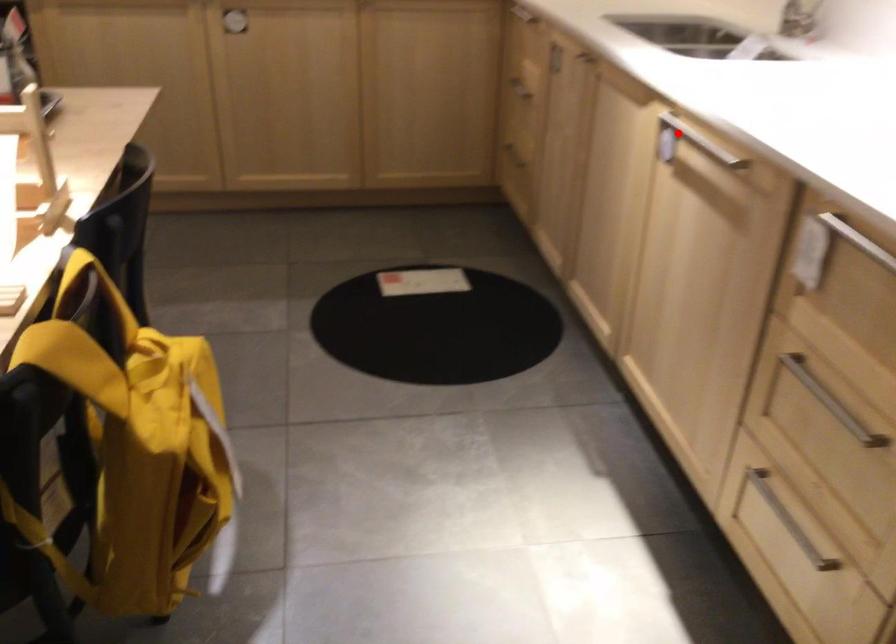
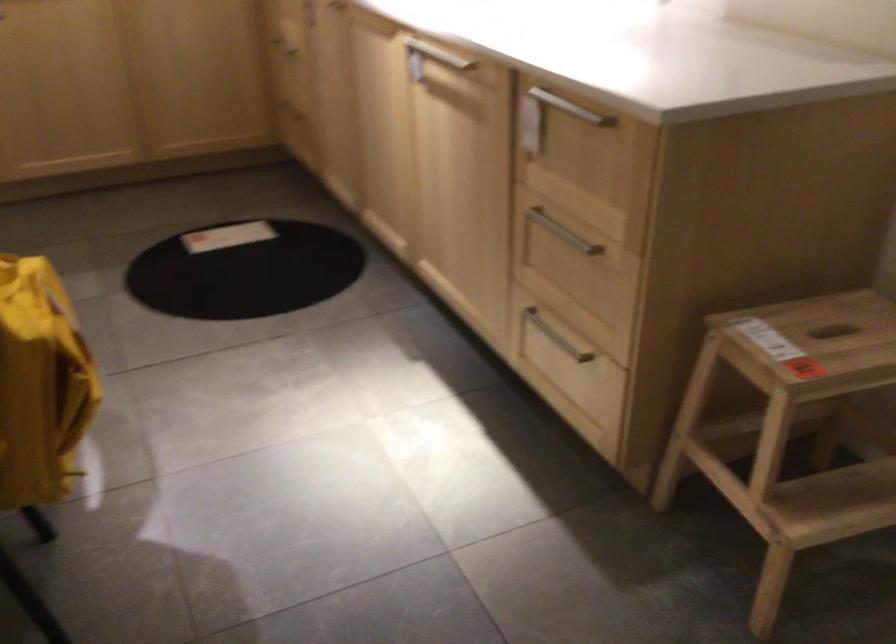
Question: I am providing you with two images of the same scene from different viewpoints. Given a red point in image1, look at the same physical point in image2. Is it:

Choices:
 (A) Closer to the viewpoint
 (B) Farther from the viewpoint

Answer: (B)